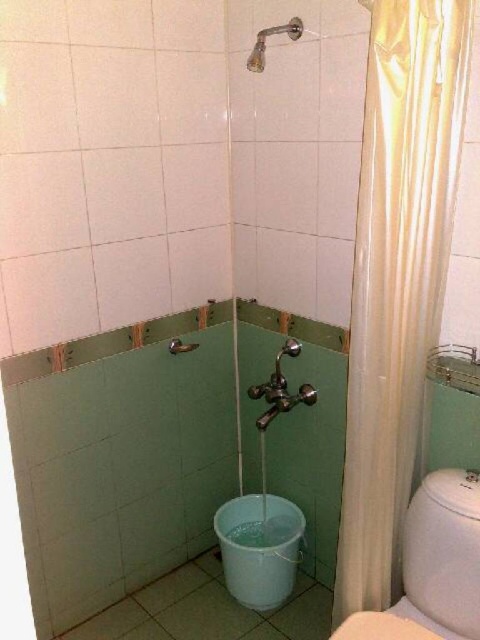
Question: Which of the following is the closest to the observer?

Choices:
 (A) green matte bath at lower center
 (B) matte silver shower head at upper center

Answer: (A)

Question: Is white satin shower curtain at right to the right of matte silver shower head at upper center from the viewer's perspective?

Choices:
 (A) yes
 (B) no

Answer: (A)

Question: Among these objects, which one is nearest to the camera?

Choices:
 (A) matte silver shower at upper center
 (B) green matte bath at lower center
 (C) white glossy toilet bowl at lower center
 (D) matte silver shower head at upper center

Answer: (B)

Question: Does white satin shower curtain at right appear on the right side of white glossy toilet bowl at lower right?

Choices:
 (A) yes
 (B) no

Answer: (B)

Question: Among these points, which one is farthest from the camera?

Choices:
 (A) click(x=350, y=573)
 (B) click(x=475, y=486)
 (C) click(x=263, y=28)

Answer: (C)

Question: From the image, what is the correct spatial relationship of white satin shower curtain at right in relation to matte silver shower head at upper center?

Choices:
 (A) below
 (B) above

Answer: (A)